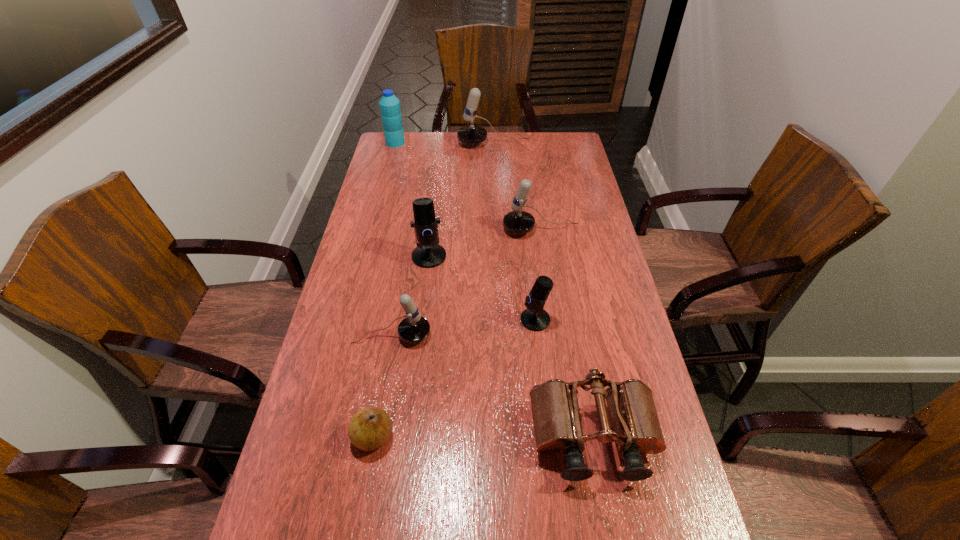
Image resolution: width=960 pixels, height=540 pixels. I want to click on the nearer black microphone, so click(x=535, y=318).

What are the coordinates of `binoculars` in the screenshot? It's located at (555, 409).

Identify the location of brown pear. The image size is (960, 540). (370, 428).

This screenshot has height=540, width=960. Find the location of `free spot located on the left of the farthest microphone`. free spot located on the left of the farthest microphone is located at coordinates (421, 143).

At what (x,y) coordinates should I click in order to perform the action: click on vacant space situated 0.340m on the right of the blue water bottle. Please return your answer as a coordinate pair (x, y). The width and height of the screenshot is (960, 540). Looking at the image, I should click on (482, 143).

Locate an element on the screen. The width and height of the screenshot is (960, 540). vacant space located on the stand of the farther black microphone is located at coordinates (425, 289).

Find the location of a particular element. The height and width of the screenshot is (540, 960). vacant space located on the back of the second farthest microphone is located at coordinates (538, 206).

Where is `vacant area located 0.400m on the front of the smallest white microphone`? This screenshot has width=960, height=540. vacant area located 0.400m on the front of the smallest white microphone is located at coordinates (362, 509).

The width and height of the screenshot is (960, 540). I want to click on free space located on the stand of the nearer black microphone, so click(422, 320).

Locate an element on the screen. vacant region located on the stand of the nearer black microphone is located at coordinates (391, 320).